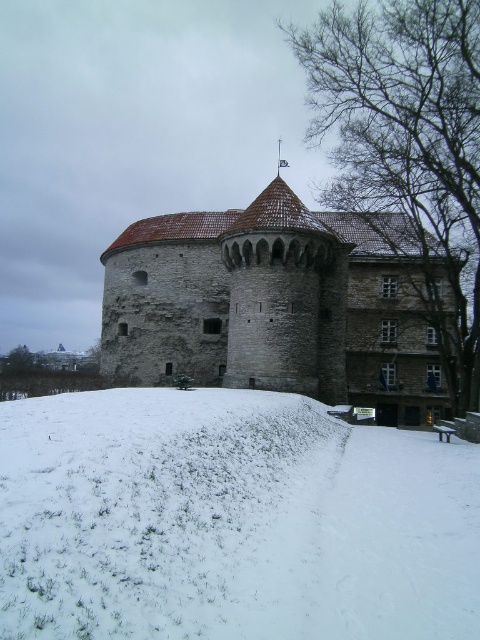
Question: Does white fluffy snow at lower center appear over stone tower at center?

Choices:
 (A) yes
 (B) no

Answer: (B)

Question: Is white fluffy snow at lower center above stone tower at center?

Choices:
 (A) no
 (B) yes

Answer: (A)

Question: Which of the following is the closest to the observer?

Choices:
 (A) (314, 276)
 (B) (142, 592)

Answer: (B)

Question: Does white fluffy snow at lower center have a lesser width compared to stone tower at center?

Choices:
 (A) no
 (B) yes

Answer: (B)